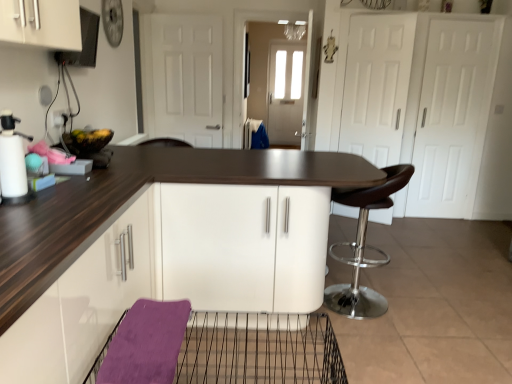
Question: Can you confirm if brown leather stool at right is positioned to the right of wire mesh basket at lower center?

Choices:
 (A) yes
 (B) no

Answer: (A)

Question: Is wire mesh basket at lower center completely or partially inside brown leather stool at right?

Choices:
 (A) no
 (B) yes

Answer: (A)

Question: From the image's perspective, is brown leather stool at right over wire mesh basket at lower center?

Choices:
 (A) no
 (B) yes

Answer: (B)

Question: Does brown leather stool at right have a lesser height compared to wire mesh basket at lower center?

Choices:
 (A) yes
 (B) no

Answer: (B)

Question: Is brown leather stool at right not close to wire mesh basket at lower center?

Choices:
 (A) yes
 (B) no

Answer: (B)

Question: Based on their sizes in the image, would you say brown leather stool at right is bigger or smaller than wire mesh basket at lower center?

Choices:
 (A) small
 (B) big

Answer: (B)

Question: Do you think brown leather stool at right is within wire mesh basket at lower center, or outside of it?

Choices:
 (A) outside
 (B) inside

Answer: (A)

Question: Looking at their shapes, would you say brown leather stool at right is wider or thinner than wire mesh basket at lower center?

Choices:
 (A) thin
 (B) wide

Answer: (B)

Question: From the image's perspective, relative to wire mesh basket at lower center, is brown leather stool at right above or below?

Choices:
 (A) below
 (B) above

Answer: (B)

Question: From their relative heights in the image, would you say white matte spray bottle at left is taller or shorter than white matte door at center?

Choices:
 (A) short
 (B) tall

Answer: (A)

Question: Is white matte spray bottle at left in front of or behind white matte door at center in the image?

Choices:
 (A) front
 (B) behind

Answer: (A)

Question: Considering the positions of white matte spray bottle at left and white matte door at center in the image, is white matte spray bottle at left bigger or smaller than white matte door at center?

Choices:
 (A) small
 (B) big

Answer: (A)

Question: In the image, is white matte spray bottle at left on the left side or the right side of white matte door at center?

Choices:
 (A) right
 (B) left

Answer: (B)

Question: From the image's perspective, is wire mesh basket at lower center positioned above or below white matte door at center?

Choices:
 (A) below
 (B) above

Answer: (A)

Question: Considering the relative positions of wire mesh basket at lower center and white matte door at center in the image provided, is wire mesh basket at lower center to the left or to the right of white matte door at center?

Choices:
 (A) left
 (B) right

Answer: (B)